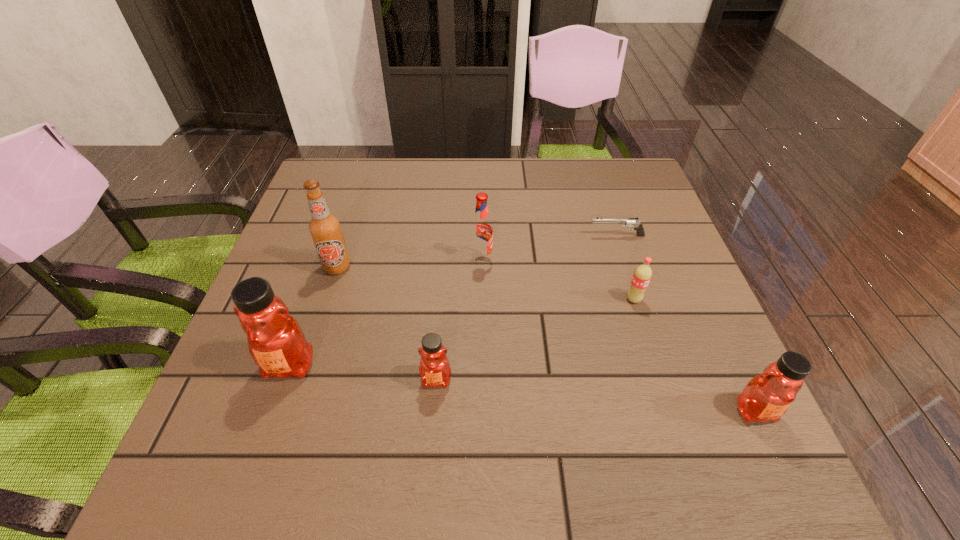
Identify the location of soda that is at the right edge. This screenshot has height=540, width=960. 642,275.

Locate an element on the screen. pistol present at the right edge is located at coordinates (626, 222).

At what (x,y) coordinates should I click in order to perform the action: click on object present at the near left corner. Please return your answer as a coordinate pair (x, y). This screenshot has width=960, height=540. Looking at the image, I should click on (276, 342).

You are a GUI agent. You are given a task and a screenshot of the screen. Output one action in this format:
    pyautogui.click(x=<x>, y=<y>)
    Task: Click on the object situated at the near right corner
    This screenshot has width=960, height=540.
    Given the screenshot: What is the action you would take?
    pyautogui.click(x=767, y=396)

The width and height of the screenshot is (960, 540). In the image, there is a desktop. What are the coordinates of `vacant space at the far edge` in the screenshot? It's located at (535, 195).

Where is `free space at the near edge`? This screenshot has width=960, height=540. free space at the near edge is located at coordinates (396, 423).

In the image, there is a desktop. In order to click on vacant space at the right edge in this screenshot , I will do `click(603, 224)`.

This screenshot has height=540, width=960. I want to click on vacant space at the far left corner, so click(x=359, y=161).

At what (x,y) coordinates should I click in order to perform the action: click on vacant space at the near right corner of the desktop. Please return your answer as a coordinate pair (x, y). Looking at the image, I should click on pos(676,403).

Locate an element on the screen. free space that is in between the root beer and the fourth farthest object is located at coordinates (558, 280).